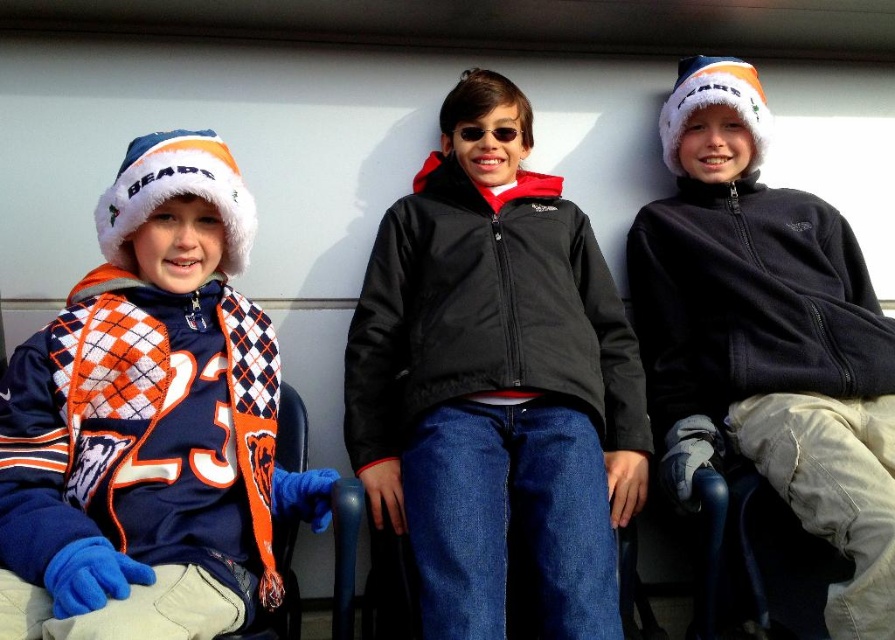
You are a photographer trying to capture a closeup of the black softshell jacket at center and the dark blue fleece jacket at center. Which jacket should you focus on first to ensure it appears clearer in the photo?

The black softshell jacket at center is closer to the viewer than the dark blue fleece jacket at center, so you should focus on the black softshell jacket at center first to ensure it appears clearer in the photo.

You are a photographer setting up for a group photo. You need to ensure that the black softshell jacket at center and the dark blue fleece jacket at center are at least 14 inches apart to avoid overlapping in the photo. Based on the current arrangement, is this requirement met?

The black softshell jacket at center and the dark blue fleece jacket at center are 13.80 inches apart from each other, which is less than the required 14 inches. Therefore, the requirement is not met and they are too close to avoid overlapping in the photo.

You are a photographer at a sports event and need to adjust your camera focus. Which object is bigger in size between the black softshell jacket at center and the argyle knit scarf at left?

The black softshell jacket at center is larger in size compared to the argyle knit scarf at left according to the description.